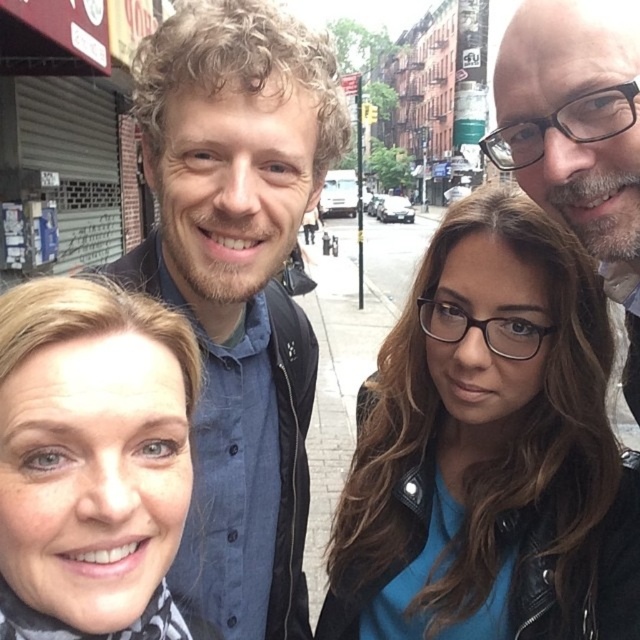
Is point (483, 600) more distant than point (113, 410)?

Yes.

Identify the location of blue matte jacket at center. Image resolution: width=640 pixels, height=640 pixels. (490, 451).

Find the location of a particular element. blue matte jacket at center is located at coordinates (490, 451).

Does point (291, 115) come farther from viewer compared to point (44, 323)?

Yes, it is behind point (44, 323).

Can you confirm if blue denim shirt at center is shorter than matte black scarf at lower left?

No.

This screenshot has height=640, width=640. I want to click on blue denim shirt at center, so click(237, 288).

Looking at this image, between blue matte jacket at center and bald head at upper right, which one is positioned higher?

bald head at upper right

Is blue matte jacket at center behind bald head at upper right?

Yes.

Where is `blue matte jacket at center`? Image resolution: width=640 pixels, height=640 pixels. blue matte jacket at center is located at coordinates (490, 451).